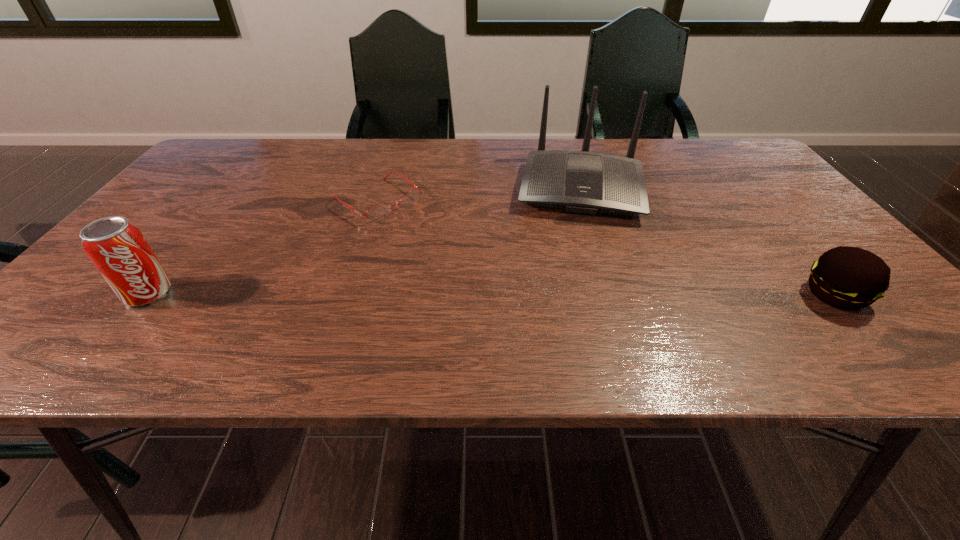
Identify the location of vacant space on the desktop that is between the soda can and the patty and is positioned on the lenses of the shortest object. Image resolution: width=960 pixels, height=540 pixels. (513, 294).

This screenshot has width=960, height=540. What are the coordinates of `vacant space on the desktop that is between the soda can and the patty and is positioned on the front-facing side of the second object from right to left` in the screenshot? It's located at (575, 294).